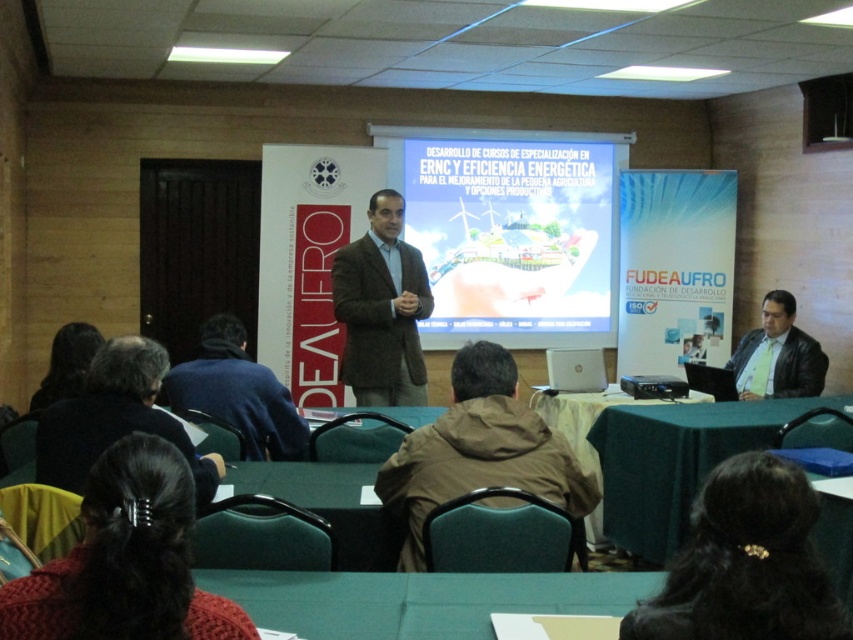
Question: Which point is closer to the camera taking this photo?

Choices:
 (A) (749, 332)
 (B) (67, 612)
 (C) (273, 449)
 (D) (392, 470)

Answer: (B)

Question: Which point appears farthest from the camera in this image?

Choices:
 (A) (453, 442)
 (B) (705, 484)
 (C) (259, 449)

Answer: (C)

Question: Can you confirm if black hair at lower center is positioned to the left of leather jacket at lower right?

Choices:
 (A) yes
 (B) no

Answer: (A)

Question: Which of the following is the closest to the observer?

Choices:
 (A) black hair at lower center
 (B) leather jacket at lower right
 (C) brown fabric jacket at center
 (D) matte white projector screen at center

Answer: (A)

Question: Does knitted red sweater at lower center have a smaller size compared to dark brown hair at lower left?

Choices:
 (A) no
 (B) yes

Answer: (B)

Question: Can you confirm if knitted red sweater at lower center is positioned to the right of green fabric table at lower right?

Choices:
 (A) no
 (B) yes

Answer: (A)